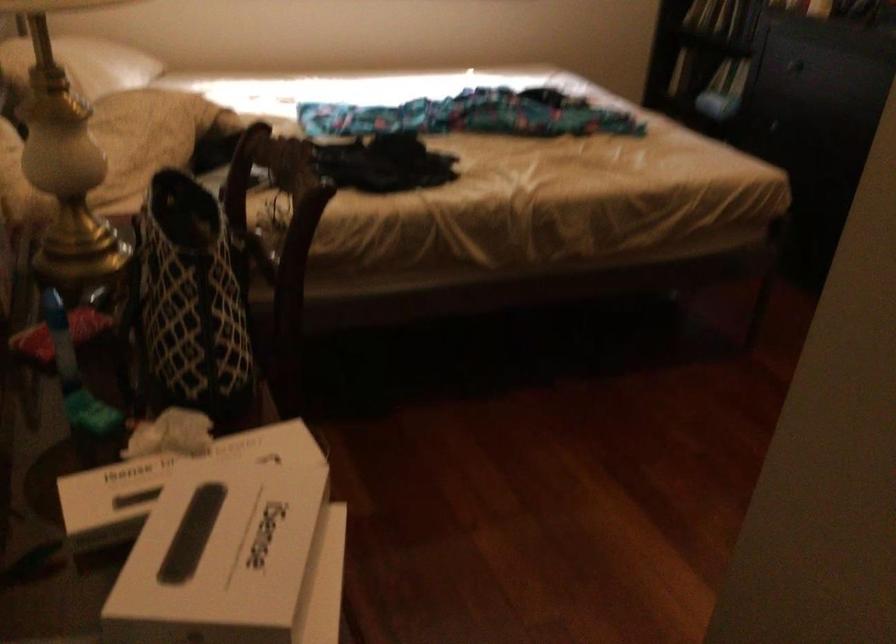
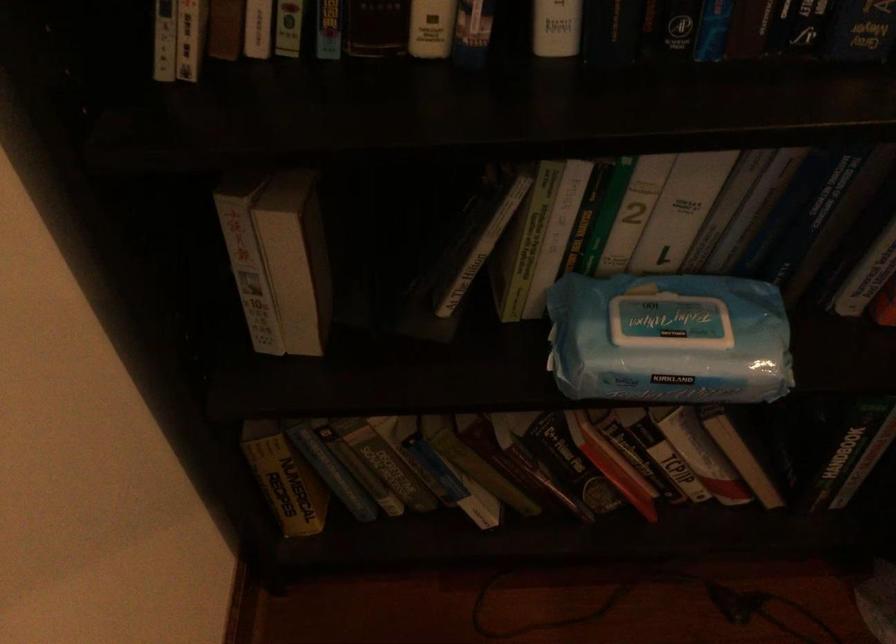
Locate, in the second image, the point that corresponds to [728,80] in the first image.

(668, 339)